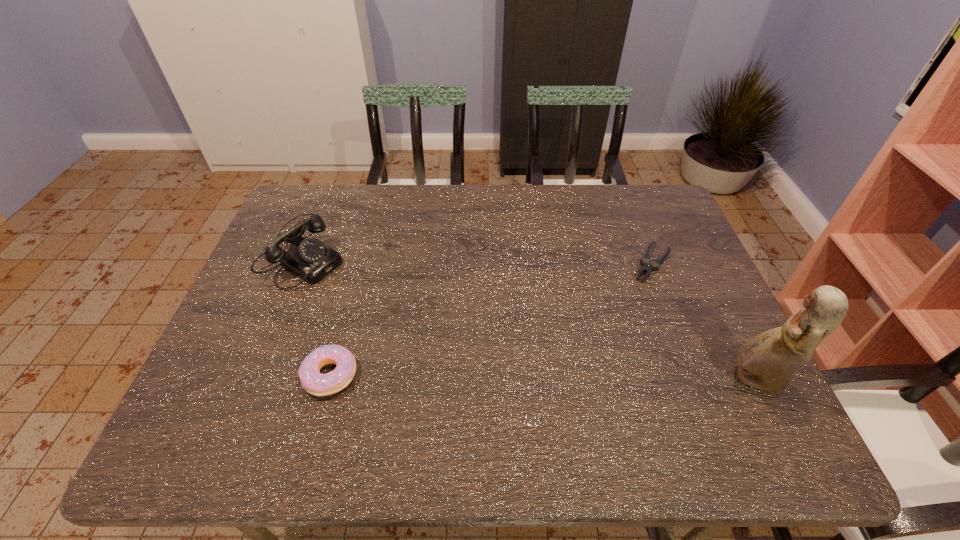
Choose which object is the second nearest neighbor to the figurine. Please provide its 2D coordinates. Your answer should be formatted as a tuple, i.e. [(x, y)], where the tuple contains the x and y coordinates of a point satisfying the conditions above.

[(315, 383)]

You are a GUI agent. You are given a task and a screenshot of the screen. Output one action in this format:
    pyautogui.click(x=<x>, y=<y>)
    Task: Click on the object that is the second closest to the figurine
    Image resolution: width=960 pixels, height=540 pixels.
    Given the screenshot: What is the action you would take?
    pyautogui.click(x=315, y=383)

I want to click on vacant space that satisfies the following two spatial constraints: 1. on the front side of the rightmost object; 2. on the front-facing side of the third object from left to right, so click(x=698, y=381).

You are a GUI agent. You are given a task and a screenshot of the screen. Output one action in this format:
    pyautogui.click(x=<x>, y=<y>)
    Task: Click on the vacant space that satisfies the following two spatial constraints: 1. on the front side of the figurine; 2. on the front-facing side of the third tallest object
    The height and width of the screenshot is (540, 960).
    Given the screenshot: What is the action you would take?
    pyautogui.click(x=328, y=381)

Where is `vacant region that satisfies the following two spatial constraints: 1. on the front side of the doughnut; 2. on the front-facing side of the rightmost object`? This screenshot has width=960, height=540. vacant region that satisfies the following two spatial constraints: 1. on the front side of the doughnut; 2. on the front-facing side of the rightmost object is located at coordinates (328, 381).

Find the location of a particular element. This screenshot has height=540, width=960. vacant space that satisfies the following two spatial constraints: 1. on the front side of the shortest object; 2. on the front-facing side of the figurine is located at coordinates pyautogui.click(x=698, y=381).